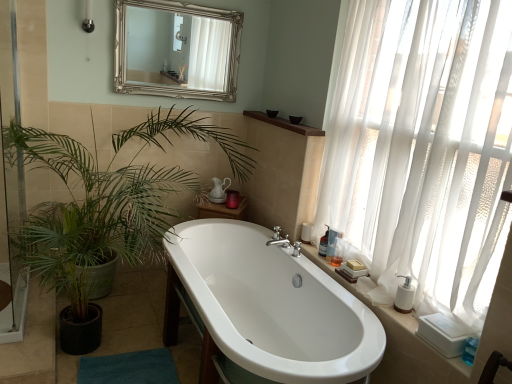
Identify the location of vacant space situated above blue fabric bath mat at lower left (from a real-world perspective). (126, 369).